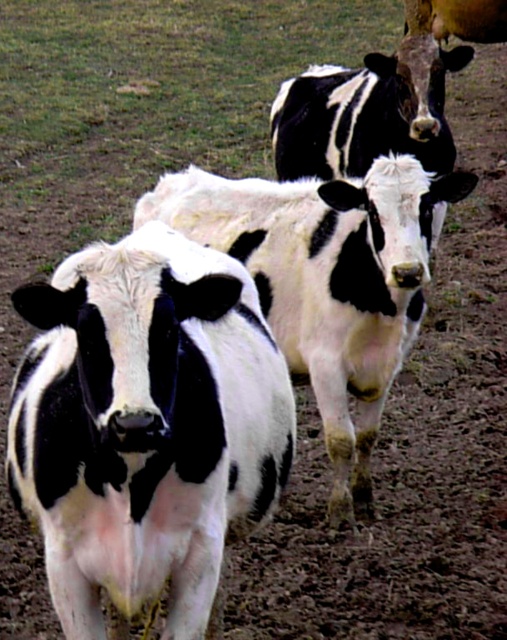
Can you confirm if black and white fur at center is bigger than black and white cow at center?

No, black and white fur at center is not bigger than black and white cow at center.

The height and width of the screenshot is (640, 507). I want to click on black and white fur at center, so click(146, 426).

The height and width of the screenshot is (640, 507). In order to click on black and white fur at center in this screenshot , I will do `click(146, 426)`.